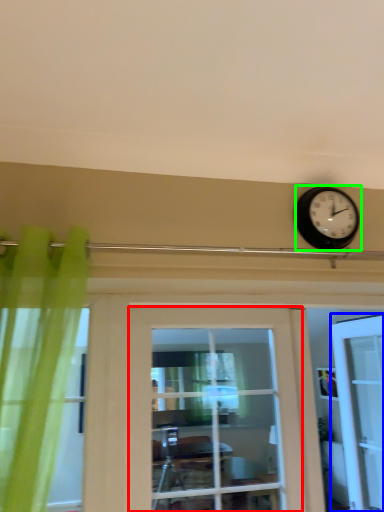
Question: Estimate the real-world distances between objects in this image. Which object is farther from door (highlighted by a red box), door (highlighted by a blue box) or wall clock (highlighted by a green box)?

Choices:
 (A) door
 (B) wall clock

Answer: (A)